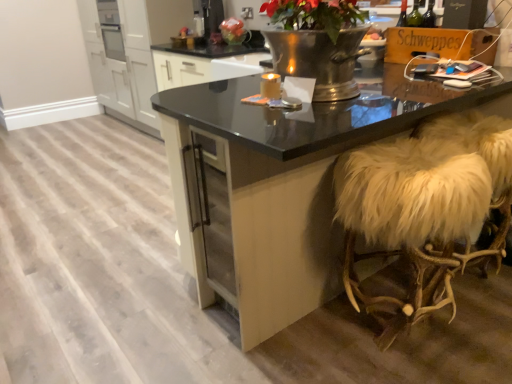
You are a GUI agent. You are given a task and a screenshot of the screen. Output one action in this format:
    pyautogui.click(x=<x>, y=<y>)
    Task: Click on the free space that is to the left of white fur-covered stool at right
    The image size is (512, 384).
    Given the screenshot: What is the action you would take?
    pyautogui.click(x=296, y=347)